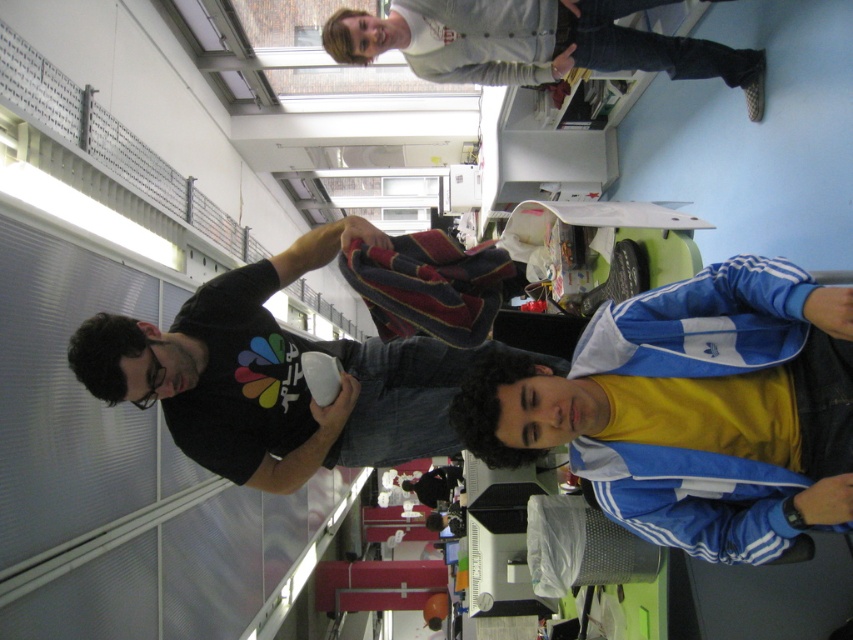
Who is higher up, black matte t-shirt at center or white cotton shirt at upper center?

Positioned higher is white cotton shirt at upper center.

Is point (244, 355) farther from camera compared to point (554, 1)?

No, it is in front of (554, 1).

The image size is (853, 640). Find the location of `black matte t-shirt at center`. black matte t-shirt at center is located at coordinates point(276,378).

Between blue/white adidas jacket at lower right and white cotton shirt at upper center, which one is positioned lower?

blue/white adidas jacket at lower right is below.

Is blue/white adidas jacket at lower right positioned before white cotton shirt at upper center?

Yes, blue/white adidas jacket at lower right is in front of white cotton shirt at upper center.

Does point (666, 388) lie behind point (366, 61)?

No.

You are a GUI agent. You are given a task and a screenshot of the screen. Output one action in this format:
    pyautogui.click(x=<x>, y=<y>)
    Task: Click on the blue/white adidas jacket at lower right
    This screenshot has height=640, width=853.
    Given the screenshot: What is the action you would take?
    pyautogui.click(x=694, y=410)

Does blue/white adidas jacket at lower right appear under black matte t-shirt at center?

Indeed, blue/white adidas jacket at lower right is positioned under black matte t-shirt at center.

What do you see at coordinates (694, 410) in the screenshot? I see `blue/white adidas jacket at lower right` at bounding box center [694, 410].

Locate an element on the screen. blue/white adidas jacket at lower right is located at coordinates (694, 410).